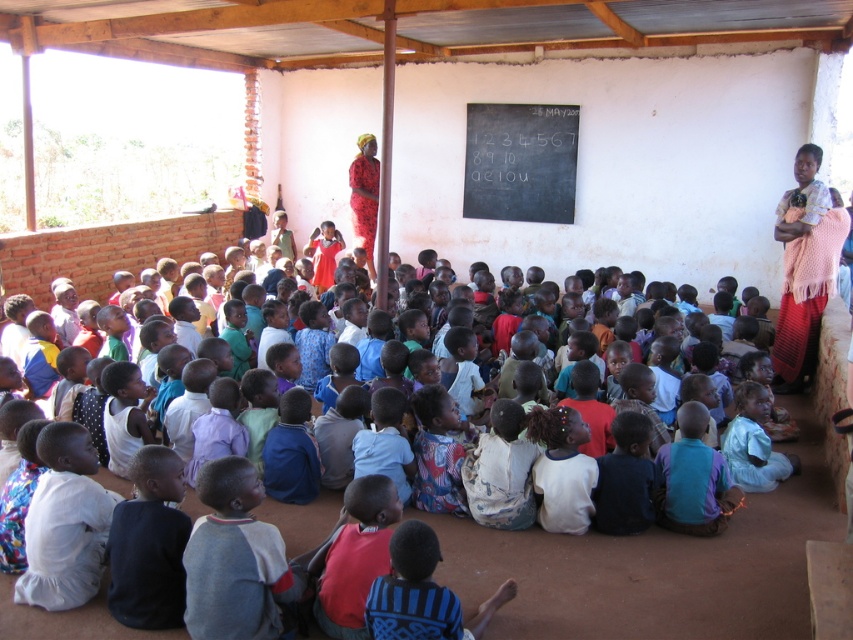
You are a student in the classroom and want to write on the black chalkboard at center. To do so, you need to move past the pink knitted shawl at upper right. Is the chalkboard above or below the shawl?

The black chalkboard at center is located above the pink knitted shawl at upper right, so the chalkboard is above the shawl.